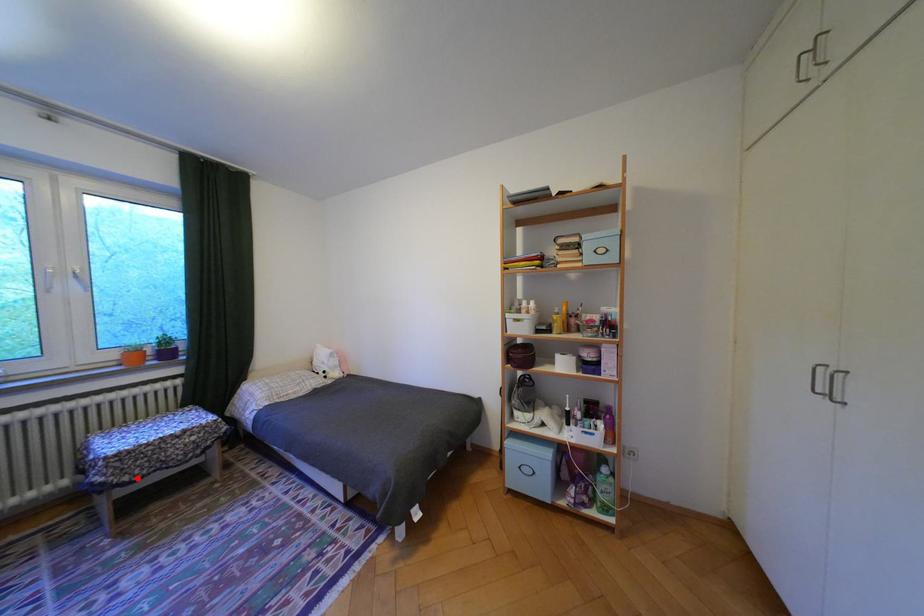
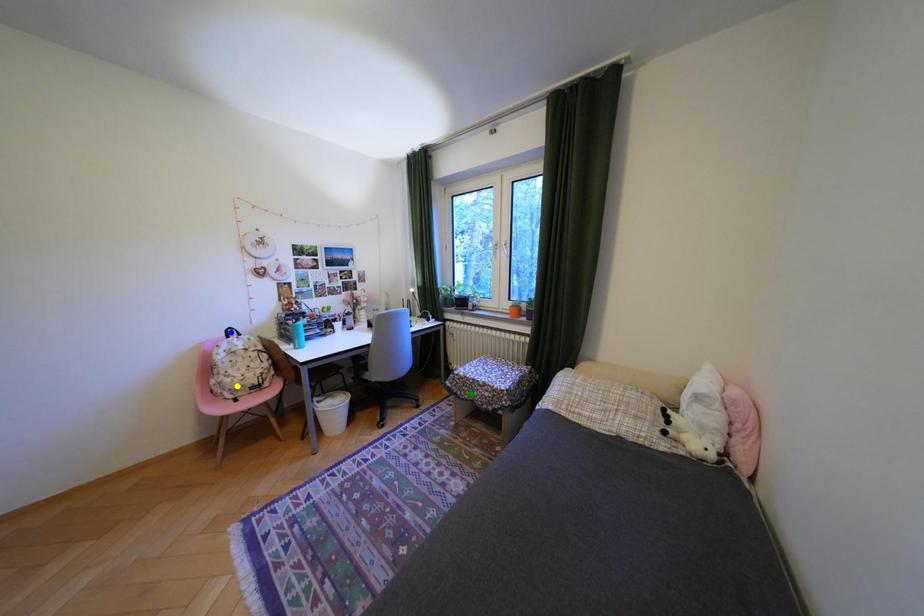
Question: I am providing you with two images of the same scene from different viewpoints. A red point is marked on the first image. You are given multiple points on the second image. Can you choose the point in image 2 that corresponds to the point in image 1?

Choices:
 (A) yellow point
 (B) green point
 (C) blue point

Answer: (B)